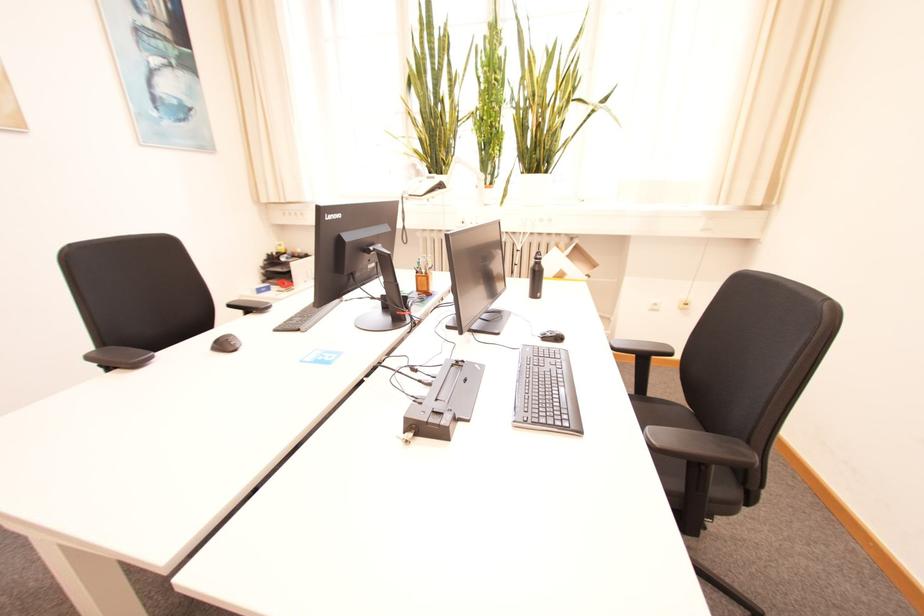
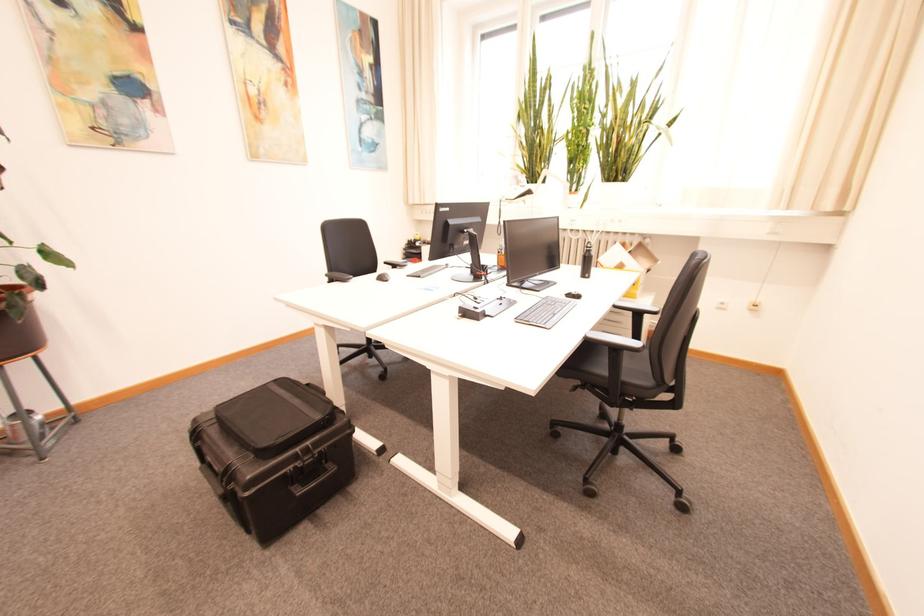
Where in the second image is the point corresponding to (x=229, y=346) from the first image?

(388, 280)